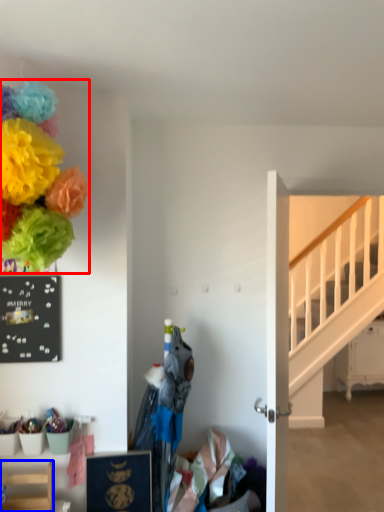
Question: Among these objects, which one is nearest to the camera, flower (highlighted by a red box) or furniture (highlighted by a blue box)?

Choices:
 (A) flower
 (B) furniture

Answer: (A)